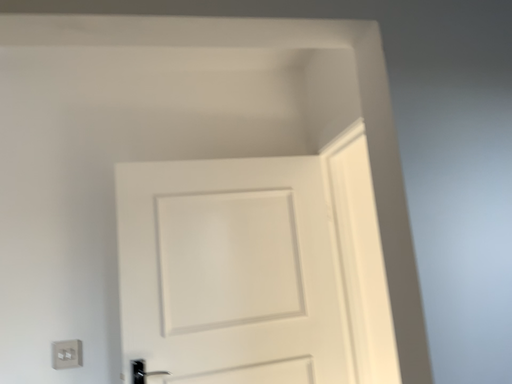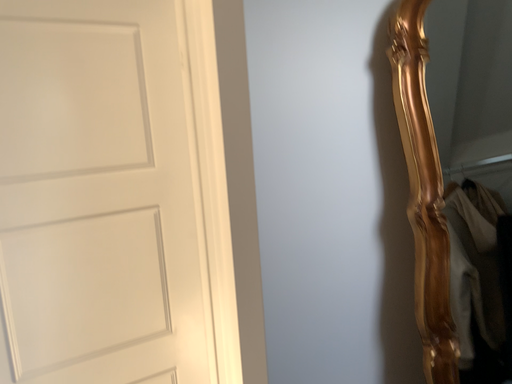
Question: Which way did the camera rotate in the video?

Choices:
 (A) rotated left
 (B) rotated right

Answer: (B)